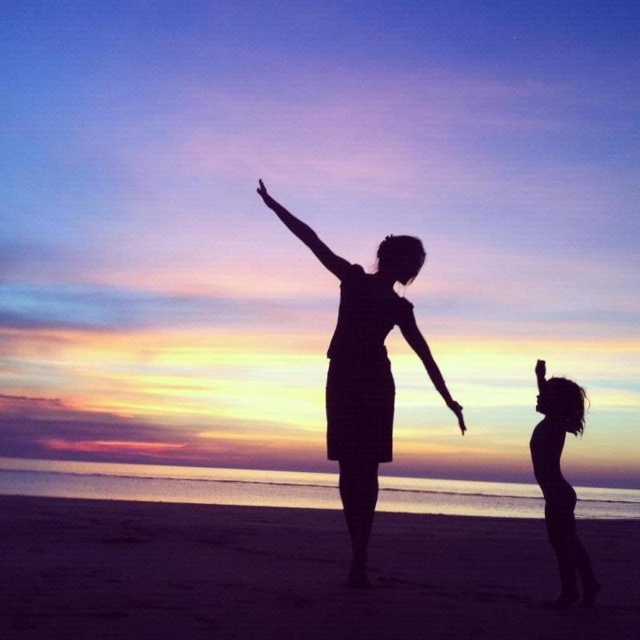
You are standing on the beach looking at the sunset. There are two points marked in the image. One is at coordinates point (x=280, y=552) and the other is at point (x=339, y=264). Which point is closer to you?

Point (x=280, y=552) is further to the viewer than point (x=339, y=264), so the closer point to you is point (x=339, y=264).

You are a photographer trying to capture the sunset scene. You notice the smooth sand at lower center and the silhouette dress at center. Which object in the scene is wider?

The smooth sand at lower center is wider than the silhouette dress at center.

You are standing on the beach in the image and want to place a small flag exactly where the smooth sand at lower center is located. According to the coordinates provided, what are the exact coordinates where you should place the flag?

The smooth sand at lower center is located at point (294, 573), so you should place the flag at those coordinates.